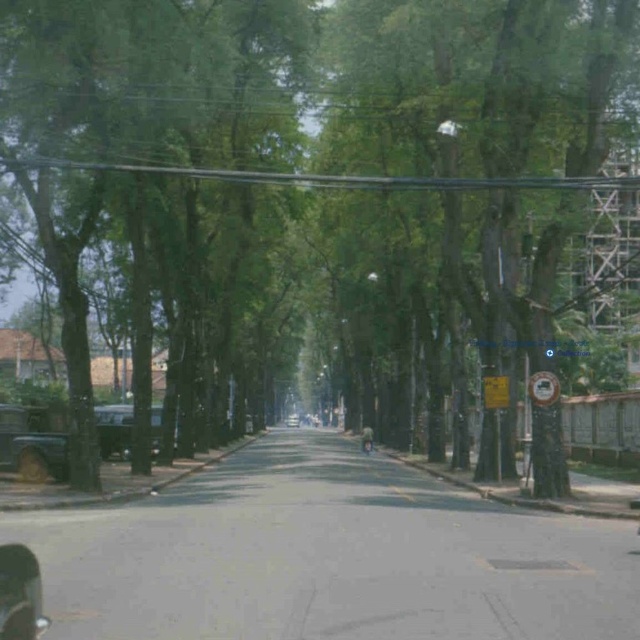
Can you confirm if metallic wire at upper center is smaller than metallic silver car at left?

Actually, metallic wire at upper center might be larger than metallic silver car at left.

Who is positioned more to the right, metallic wire at upper center or metallic silver car at left?

Positioned to the right is metallic wire at upper center.

Where is `metallic wire at upper center`? The image size is (640, 640). metallic wire at upper center is located at coordinates (336, 177).

Can you confirm if metallic wire at upper center is bigger than metallic gray car at left?

Yes, metallic wire at upper center is bigger than metallic gray car at left.

The height and width of the screenshot is (640, 640). In order to click on metallic wire at upper center in this screenshot , I will do `click(336, 177)`.

Where is `metallic wire at upper center`? The height and width of the screenshot is (640, 640). metallic wire at upper center is located at coordinates (336, 177).

Where is `metallic wire at upper center`? metallic wire at upper center is located at coordinates (336, 177).

Does metallic wire at upper center have a greater height compared to metallic silver car at center?

Correct, metallic wire at upper center is much taller as metallic silver car at center.

Between point (156, 170) and point (298, 422), which one is positioned behind?

Point (298, 422)

Where is `metallic wire at upper center`? The image size is (640, 640). metallic wire at upper center is located at coordinates (336, 177).